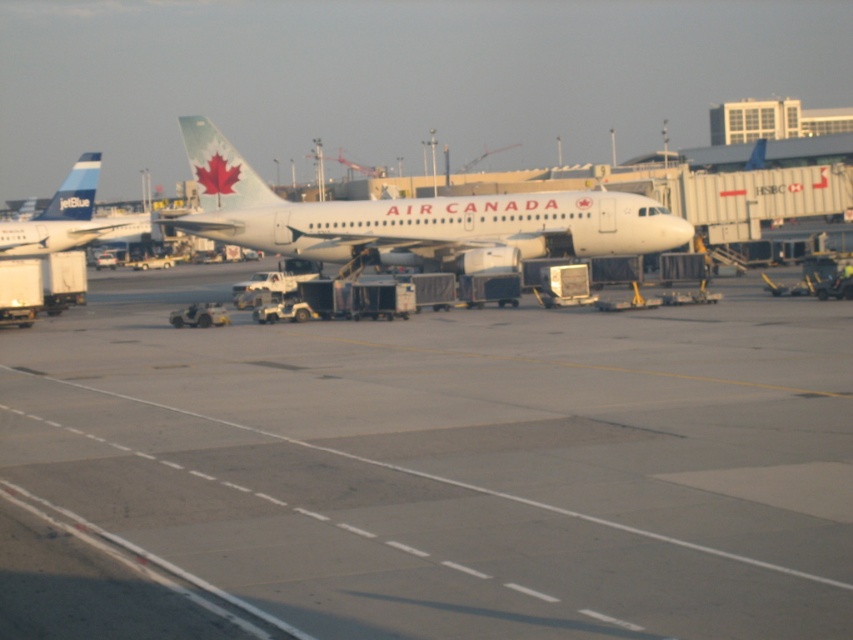
You are standing on the airport tarmac and want to reach the Air Canada aircraft parked at the gate. According to the coordinates provided, where is the gray concrete tarmac at center located?

The gray concrete tarmac at center is located at point (427, 470).

You are standing at the point marked as point (x=427, y=470) on the image. What is the material of the surface you are standing on?

The surface at point (x=427, y=470) is gray concrete tarmac at center.

You are a pilot who just landed your plane and need to park it. You see the gray concrete tarmac at center and the matte blue airplane at left. Which area has more space available for parking your aircraft?

The matte blue airplane at left occupies more space than the gray concrete tarmac at center, so the gray concrete tarmac at center has less space available. Therefore, the matte blue airplane at left area has more space available for parking your aircraft.